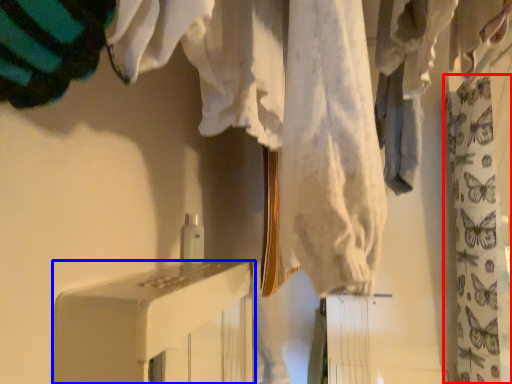
Question: Which object is closer to the camera taking this photo, curtain (highlighted by a red box) or furniture (highlighted by a blue box)?

Choices:
 (A) curtain
 (B) furniture

Answer: (B)